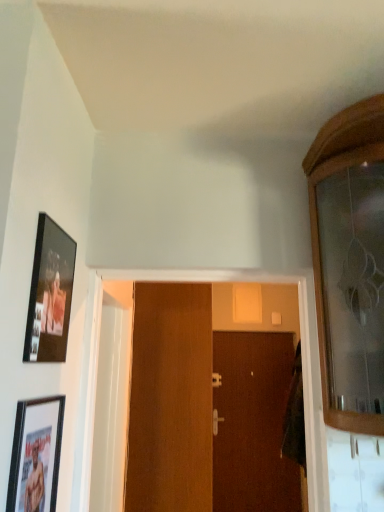
Question: Is silver metallic door handle at center, the second door handle positioned from the front, at the back of brown wooden door at center, which is the 2th door from front to back?

Choices:
 (A) yes
 (B) no

Answer: (B)

Question: Is brown wooden door at center, positioned as the 1th door in back-to-front order, taller than silver metallic door handle at center, which is the first door handle in top-to-bottom order?

Choices:
 (A) yes
 (B) no

Answer: (A)

Question: Is brown wooden door at center, arranged as the 2th door when viewed from the left, oriented towards silver metallic door handle at center, the second door handle from the bottom?

Choices:
 (A) yes
 (B) no

Answer: (A)

Question: Considering the relative positions of brown wooden door at center, arranged as the 2th door when viewed from the left, and silver metallic door handle at center, the first door handle from the back, in the image provided, is brown wooden door at center, arranged as the 2th door when viewed from the left, to the right of silver metallic door handle at center, the first door handle from the back, from the viewer's perspective?

Choices:
 (A) no
 (B) yes

Answer: (B)

Question: Is the depth of brown wooden door at center, positioned as the 1th door in back-to-front order, greater than that of silver metallic door handle at center, which is the first door handle in top-to-bottom order?

Choices:
 (A) no
 (B) yes

Answer: (A)

Question: In terms of width, does matte black picture frame at upper left, which is the 1th picture frame in top-to-bottom order, look wider or thinner when compared to matte black picture frame at lower left, acting as the second picture frame starting from the top?

Choices:
 (A) thin
 (B) wide

Answer: (B)

Question: From their relative heights in the image, would you say matte black picture frame at upper left, placed as the 2th picture frame when sorted from bottom to top, is taller or shorter than matte black picture frame at lower left, acting as the second picture frame starting from the top?

Choices:
 (A) tall
 (B) short

Answer: (B)

Question: Is point (29, 321) positioned closer to the camera than point (36, 402)?

Choices:
 (A) closer
 (B) farther

Answer: (A)

Question: Is matte black picture frame at upper left, which is the 1th picture frame in top-to-bottom order, inside the boundaries of matte black picture frame at lower left, acting as the second picture frame starting from the top, or outside?

Choices:
 (A) outside
 (B) inside

Answer: (A)

Question: Would you say matte black picture frame at lower left, which appears as the 1th picture frame when ordered from the bottom, is to the left or to the right of silver metallic door handle at center, the second door handle positioned from the front, in the picture?

Choices:
 (A) left
 (B) right

Answer: (A)

Question: In terms of height, does matte black picture frame at lower left, acting as the second picture frame starting from the top, look taller or shorter compared to silver metallic door handle at center, which is the first door handle in top-to-bottom order?

Choices:
 (A) short
 (B) tall

Answer: (B)

Question: In the image, is matte black picture frame at lower left, which appears as the 1th picture frame when ordered from the bottom, positioned in front of or behind silver metallic door handle at center, which is the first door handle in top-to-bottom order?

Choices:
 (A) front
 (B) behind

Answer: (A)

Question: Based on their sizes in the image, would you say matte black picture frame at lower left, acting as the second picture frame starting from the top, is bigger or smaller than silver metallic door handle at center, the second door handle positioned from the front?

Choices:
 (A) big
 (B) small

Answer: (A)

Question: Considering their positions, is wooden door at center, the first door when ordered from left to right, located in front of or behind matte black picture frame at upper left, placed as the 2th picture frame when sorted from bottom to top?

Choices:
 (A) front
 (B) behind

Answer: (B)

Question: Is point (208, 290) closer or farther from the camera than point (64, 232)?

Choices:
 (A) farther
 (B) closer

Answer: (A)